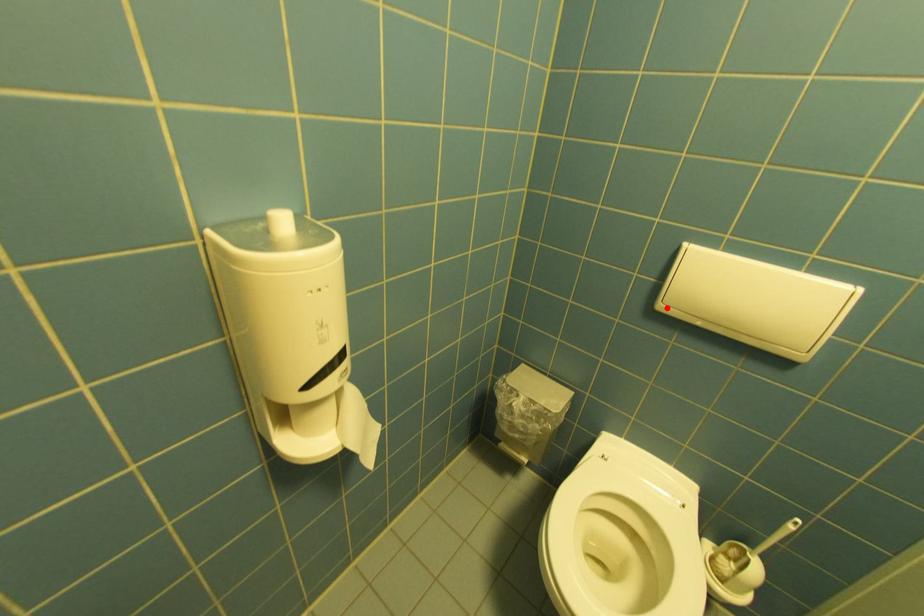
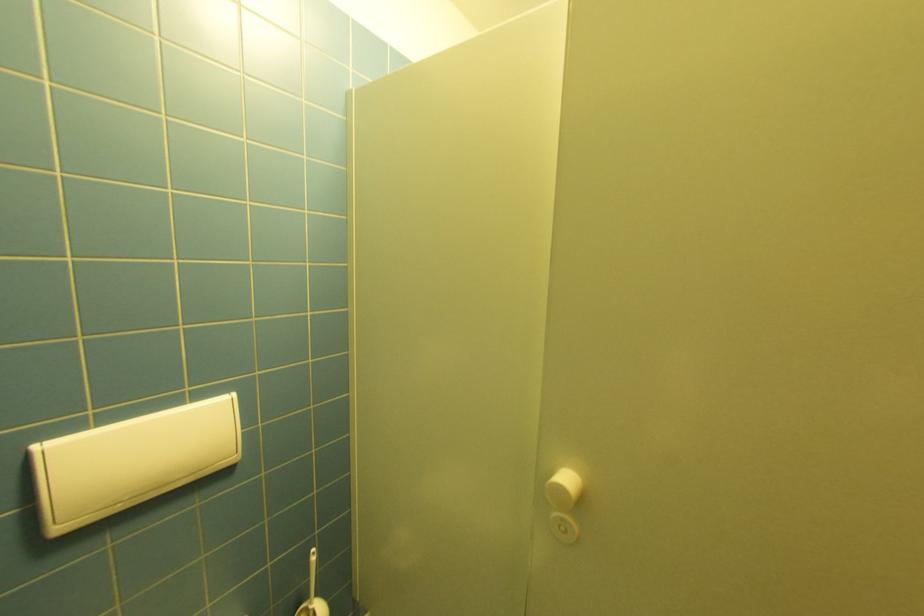
Where in the second image is the point corresponding to the highlighted location from the first image?

(66, 530)